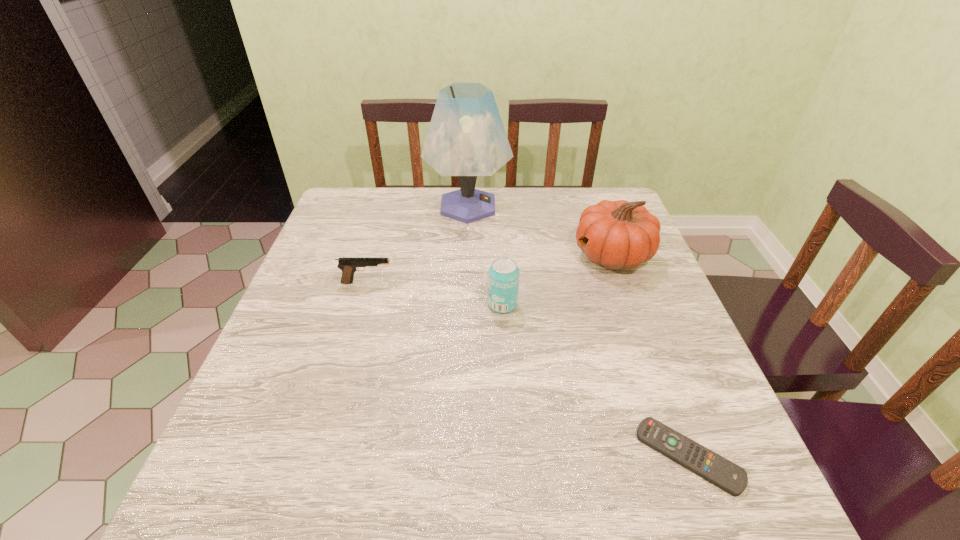
Identify the location of vacant area between the fourth tallest object and the beer can. Image resolution: width=960 pixels, height=540 pixels. (435, 293).

You are a GUI agent. You are given a task and a screenshot of the screen. Output one action in this format:
    pyautogui.click(x=<x>, y=<y>)
    Task: Click on the free space between the leftmost object and the farthest object
    The width and height of the screenshot is (960, 540).
    Given the screenshot: What is the action you would take?
    pyautogui.click(x=418, y=244)

This screenshot has width=960, height=540. In order to click on vacant area that lies between the beer can and the pumpkin in this screenshot , I will do `click(558, 280)`.

Select which object appears as the fourth closest to the nearest object. Please provide its 2D coordinates. Your answer should be formatted as a tuple, i.e. [(x, y)], where the tuple contains the x and y coordinates of a point satisfying the conditions above.

[(466, 138)]

At what (x,y) coordinates should I click in order to perform the action: click on the fourth closest object to the tallest object. Please return your answer as a coordinate pair (x, y). This screenshot has height=540, width=960. Looking at the image, I should click on coord(728,476).

I want to click on free space that satisfies the following two spatial constraints: 1. on the base of the shortest object; 2. on the right side of the farthest object, so click(459, 456).

This screenshot has height=540, width=960. Identify the location of vacant area in the image that satisfies the following two spatial constraints: 1. on the face of the second tallest object; 2. on the right side of the shortest object. (685, 456).

Where is `free location that satisfies the following two spatial constraints: 1. on the face of the pumpkin; 2. on the front side of the fourth farthest object`? The width and height of the screenshot is (960, 540). free location that satisfies the following two spatial constraints: 1. on the face of the pumpkin; 2. on the front side of the fourth farthest object is located at coordinates (631, 305).

In order to click on vacant space that satisfies the following two spatial constraints: 1. on the base of the tallest object; 2. on the back side of the third tallest object in this screenshot , I will do `click(465, 305)`.

The height and width of the screenshot is (540, 960). I want to click on free location that satisfies the following two spatial constraints: 1. on the base of the tallest object; 2. on the left side of the nearest object, so coord(459,456).